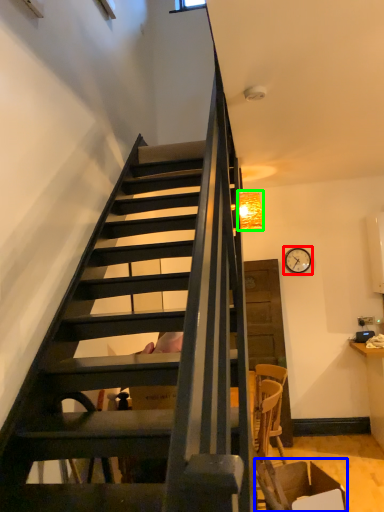
Question: Estimate the real-world distances between objects in this image. Which object is farther from clock (highlighted by a red box), armchair (highlighted by a blue box) or lamp (highlighted by a green box)?

Choices:
 (A) armchair
 (B) lamp

Answer: (A)